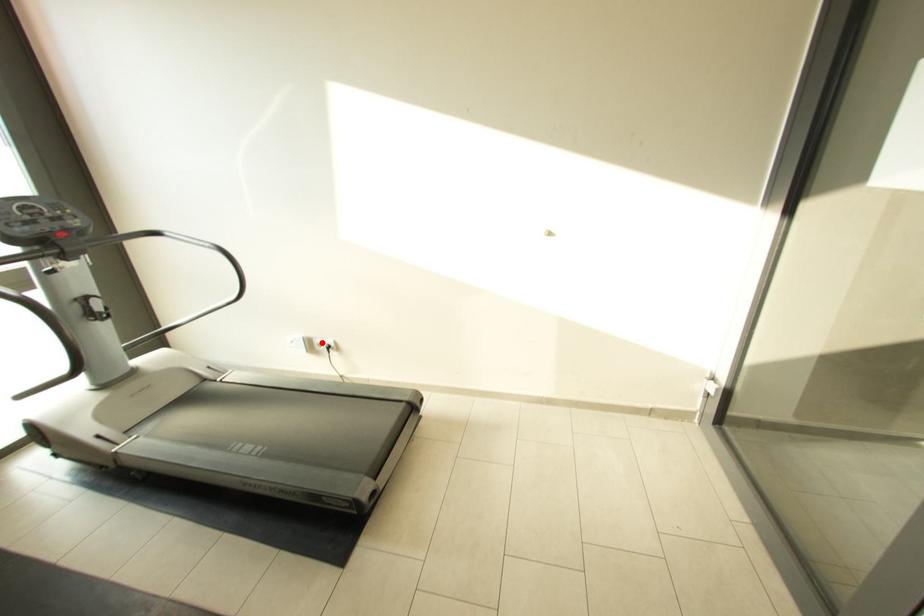
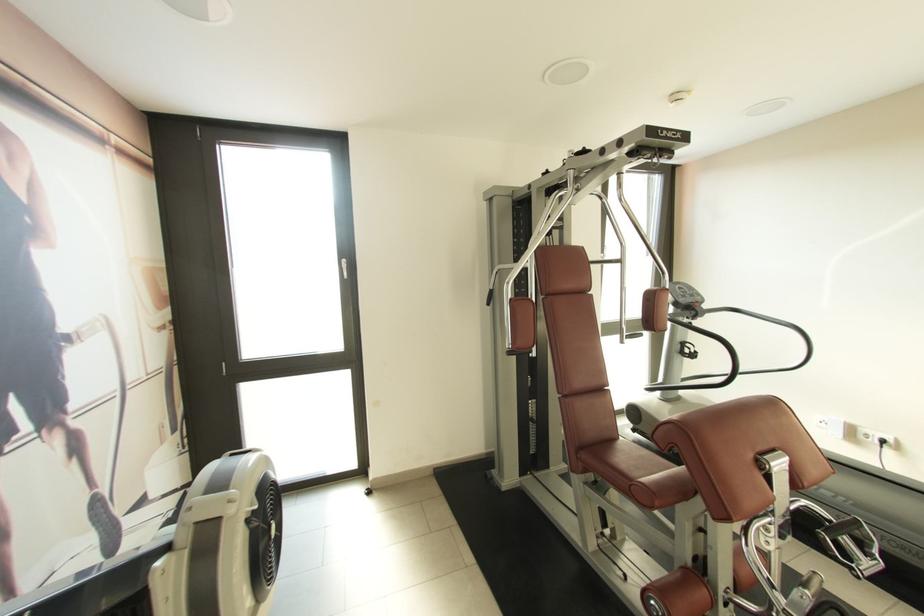
Question: A red point is marked in image1. In image2, is the corresponding 3D point closer to the camera or farther? Reply with the corresponding letter.

Choices:
 (A) The corresponding 3D point is closer.
 (B) The corresponding 3D point is farther.

Answer: (A)